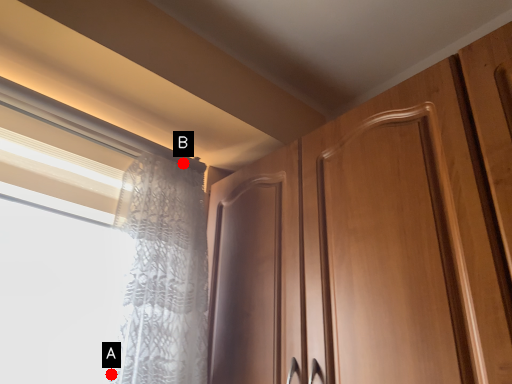
Question: Two points are circled on the image, labeled by A and B beside each circle. Among these points, which one is farthest from the camera?

Choices:
 (A) A is further
 (B) B is further

Answer: (B)